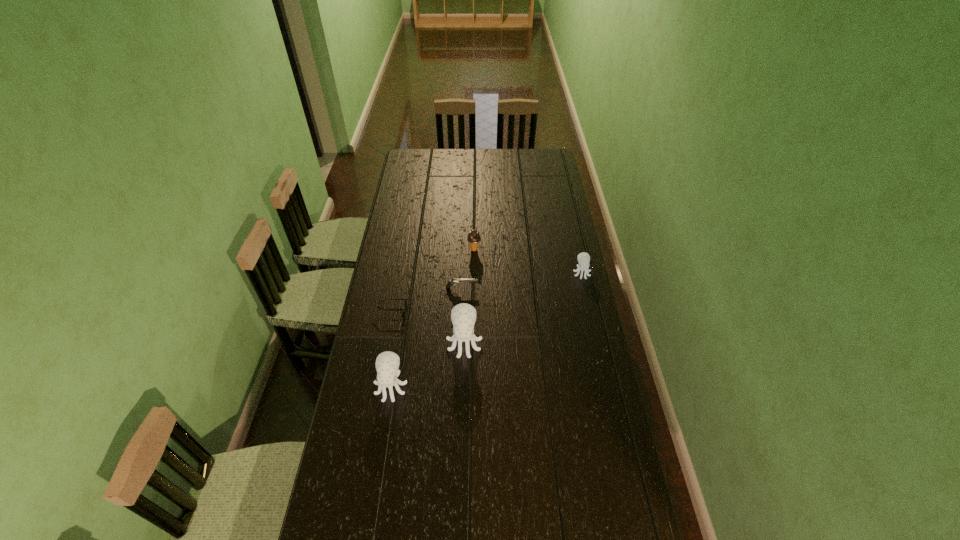
You are a GUI agent. You are given a task and a screenshot of the screen. Output one action in this format:
    pyautogui.click(x=<x>, y=<y>)
    Task: Click on the object located in the right edge section of the desktop
    The image size is (960, 540).
    Given the screenshot: What is the action you would take?
    [583, 258]

Locate an element on the screen. blank space at the far edge is located at coordinates (482, 168).

You are a GUI agent. You are given a task and a screenshot of the screen. Output one action in this format:
    pyautogui.click(x=<x>, y=<y>)
    Task: Click on the vacant space at the near edge
    
    Given the screenshot: What is the action you would take?
    pyautogui.click(x=393, y=502)

Locate an element on the screen. The height and width of the screenshot is (540, 960). free space at the left edge of the desktop is located at coordinates (386, 339).

You are a GUI agent. You are given a task and a screenshot of the screen. Output one action in this format:
    pyautogui.click(x=<x>, y=<y>)
    Task: Click on the free region at the right edge of the desktop
    The image size is (960, 540).
    Given the screenshot: What is the action you would take?
    pyautogui.click(x=577, y=409)

In the image, there is a desktop. Find the location of `vacant space at the far left corner`. vacant space at the far left corner is located at coordinates (413, 166).

Identify the location of free space between the fourth farthest object and the fifth tallest object. The width and height of the screenshot is (960, 540). (426, 300).

Locate an element on the screen. The height and width of the screenshot is (540, 960). vacant point located between the second farthest octopus and the fourth farthest object is located at coordinates (427, 328).

I want to click on free space between the rightmost object and the shortest object, so click(486, 293).

This screenshot has height=540, width=960. In order to click on free spot between the second shortest octopus and the icecream in this screenshot , I will do `click(433, 318)`.